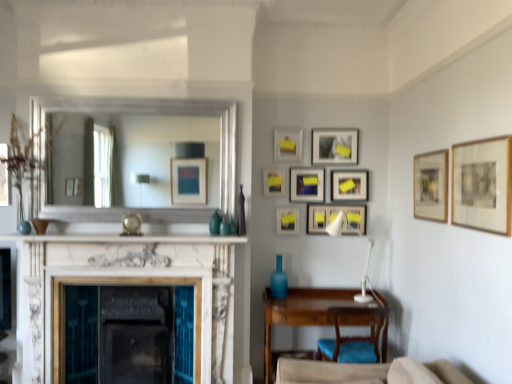
Looking at this image, what is the approximate height of white plastic lamp at center-right?

The height of white plastic lamp at center-right is 30.39 inches.

Locate an element on the screen. Image resolution: width=512 pixels, height=384 pixels. wooden desk at lower right is located at coordinates (300, 311).

In order to face wooden framed print at upper right, the ninth picture frame positioned from the back, should I rotate leftwards or rightwards?

Turn right approximately 27.218 degrees to face it.

Where is `matte black picture frame at center, which is the 2th picture frame from back to front`? matte black picture frame at center, which is the 2th picture frame from back to front is located at coordinates (334, 218).

What do you see at coordinates (306, 184) in the screenshot?
I see `matte black picture frame at center, positioned as the 9th picture frame in front-to-back order` at bounding box center [306, 184].

Where is `matte wooden picture frame at upper center, the seventh picture frame when ordered from back to front`? This screenshot has width=512, height=384. matte wooden picture frame at upper center, the seventh picture frame when ordered from back to front is located at coordinates (288, 145).

Where is `white plastic lamp at center-right`? white plastic lamp at center-right is located at coordinates (366, 278).

What's the angular difference between matte wooden picture frame at center, the 4th picture frame from the front, and silver/metallic mirror at upper center's facing directions?

matte wooden picture frame at center, the 4th picture frame from the front, and silver/metallic mirror at upper center are facing 0.138 degrees away from each other.

Considering the relative sizes of matte wooden picture frame at center, arranged as the 6th picture frame when viewed from the back, and silver/metallic mirror at upper center in the image provided, is matte wooden picture frame at center, arranged as the 6th picture frame when viewed from the back, thinner than silver/metallic mirror at upper center?

Yes, matte wooden picture frame at center, arranged as the 6th picture frame when viewed from the back, is thinner than silver/metallic mirror at upper center.

Which object is further away from the camera, matte wooden picture frame at center, arranged as the 6th picture frame when viewed from the back, or silver/metallic mirror at upper center?

matte wooden picture frame at center, arranged as the 6th picture frame when viewed from the back.

Which of these two, matte wooden picture frame at center, the 4th picture frame from the front, or silver/metallic mirror at upper center, is bigger?

silver/metallic mirror at upper center is bigger.

From a real-world perspective, is matte black picture frame at upper center, which appears as the 4th picture frame when viewed from the back, positioned over matte wooden picture frame at center, the 4th picture frame from the front, based on gravity?

Yes, from a real-world perspective, matte black picture frame at upper center, which appears as the 4th picture frame when viewed from the back, is on top of matte wooden picture frame at center, the 4th picture frame from the front.

Does matte black picture frame at upper center, which appears as the 4th picture frame when viewed from the back, turn towards matte wooden picture frame at center, arranged as the 6th picture frame when viewed from the back?

No, matte black picture frame at upper center, which appears as the 4th picture frame when viewed from the back, does not turn towards matte wooden picture frame at center, arranged as the 6th picture frame when viewed from the back.

Are matte black picture frame at upper center, the sixth picture frame when ordered from front to back, and matte wooden picture frame at center, arranged as the 6th picture frame when viewed from the back, making contact?

matte black picture frame at upper center, the sixth picture frame when ordered from front to back, is not next to matte wooden picture frame at center, arranged as the 6th picture frame when viewed from the back, and they're not touching.

How different are the orientations of matte black picture frame at upper center, the sixth picture frame when ordered from front to back, and matte wooden picture frame at center, the 4th picture frame from the front, in degrees?

matte black picture frame at upper center, the sixth picture frame when ordered from front to back, and matte wooden picture frame at center, the 4th picture frame from the front, are facing 1.19 degrees away from each other.

Which of these two, matte wooden picture frame at upper center, which ranks as the fifth picture frame in front-to-back order, or wooden framed picture at right, the eighth picture frame when ordered from back to front, is smaller?

Smaller between the two is matte wooden picture frame at upper center, which ranks as the fifth picture frame in front-to-back order.

What's the angular difference between matte wooden picture frame at upper center, which appears as the 5th picture frame when viewed from the back, and wooden framed picture at right, the eighth picture frame when ordered from back to front,'s facing directions?

There is a 92.4-degree angle between the facing directions of matte wooden picture frame at upper center, which appears as the 5th picture frame when viewed from the back, and wooden framed picture at right, the eighth picture frame when ordered from back to front.

Considering the relative sizes of matte wooden picture frame at upper center, which appears as the 5th picture frame when viewed from the back, and wooden framed picture at right, placed as the second picture frame when sorted from front to back, in the image provided, is matte wooden picture frame at upper center, which appears as the 5th picture frame when viewed from the back, shorter than wooden framed picture at right, placed as the second picture frame when sorted from front to back,?

Correct, matte wooden picture frame at upper center, which appears as the 5th picture frame when viewed from the back, is not as tall as wooden framed picture at right, placed as the second picture frame when sorted from front to back.

From the image's perspective, between matte wooden picture frame at upper center, which ranks as the fifth picture frame in front-to-back order, and wooden framed picture at right, placed as the second picture frame when sorted from front to back, who is located below?

wooden framed picture at right, placed as the second picture frame when sorted from front to back.

Between matte black picture frame at center, which is the first picture frame from back to front, and white marble fireplace at center, which one appears on the right side from the viewer's perspective?

matte black picture frame at center, which is the first picture frame from back to front, is more to the right.

Where is `mantle that appears in front of the matte black picture frame at center, which is the first picture frame from back to front`? mantle that appears in front of the matte black picture frame at center, which is the first picture frame from back to front is located at coordinates (129, 239).

Which of these two, matte black picture frame at center, positioned as the 9th picture frame in front-to-back order, or white marble fireplace at center, is wider?

white marble fireplace at center is wider.

Does white marble fireplace at center appear on the left side of blue fabric chair at lower right?

Yes, white marble fireplace at center is to the left of blue fabric chair at lower right.

Considering their positions, is white marble fireplace at center located in front of or behind blue fabric chair at lower right?

Clearly, white marble fireplace at center is in front of blue fabric chair at lower right.

Which object is wider, white marble fireplace at center or blue fabric chair at lower right?

With larger width is white marble fireplace at center.

Considering the relative sizes of matte black picture frame at center-right, which is the third picture frame in back-to-front order, and wooden desk at lower right in the image provided, is matte black picture frame at center-right, which is the third picture frame in back-to-front order, thinner than wooden desk at lower right?

Indeed, matte black picture frame at center-right, which is the third picture frame in back-to-front order, has a lesser width compared to wooden desk at lower right.

Does point (352, 187) lie behind point (341, 298)?

Yes, point (352, 187) is behind point (341, 298).

Is matte black picture frame at center-right, which is the third picture frame in back-to-front order, positioned in front of wooden desk at lower right?

No, it is not.

Which of these two, matte black picture frame at center, which is the 2th picture frame from back to front, or wooden framed print at upper right, which is counted as the first picture frame, starting from the front, stands shorter?

matte black picture frame at center, which is the 2th picture frame from back to front.

Could you tell me if matte black picture frame at center, which is the 2th picture frame from back to front, is turned towards wooden framed print at upper right, which is counted as the first picture frame, starting from the front?

Yes, matte black picture frame at center, which is the 2th picture frame from back to front, is aimed at wooden framed print at upper right, which is counted as the first picture frame, starting from the front.

Based on the photo, from the image's perspective, which is below, matte black picture frame at center, the eighth picture frame positioned from the front, or wooden framed print at upper right, which is counted as the first picture frame, starting from the front?

matte black picture frame at center, the eighth picture frame positioned from the front, appears lower in the image.

Is matte black picture frame at center, which is the 2th picture frame from back to front, spatially inside wooden framed print at upper right, which is counted as the first picture frame, starting from the front, or outside of it?

matte black picture frame at center, which is the 2th picture frame from back to front, lies outside wooden framed print at upper right, which is counted as the first picture frame, starting from the front.

Locate an element on the screen. The width and height of the screenshot is (512, 384). mirror in front of the matte wooden picture frame at center, arranged as the 6th picture frame when viewed from the back is located at coordinates (167, 114).

The image size is (512, 384). In order to click on picture frame that is the 7th one above the matte wooden picture frame at center, arranged as the 6th picture frame when viewed from the back (from a real-world perspective) in this screenshot , I will do `click(335, 146)`.

Which object lies further to the anchor point matte black picture frame at center, the eighth picture frame positioned from the front, matte wooden picture frame at upper center, the third picture frame from the front, or matte black picture frame at center-right, which is the third picture frame in back-to-front order?

Among the two, matte wooden picture frame at upper center, the third picture frame from the front, is located further to matte black picture frame at center, the eighth picture frame positioned from the front.

Based on their spatial positions, is matte black picture frame at center-right, which is the third picture frame in back-to-front order, or white marble fireplace at center further from silver/metallic mirror at upper center?

matte black picture frame at center-right, which is the third picture frame in back-to-front order, is positioned further to the anchor silver/metallic mirror at upper center.

Which object lies further to the anchor point matte black picture frame at center, positioned as the 9th picture frame in front-to-back order, white marble fireplace at center or white marble fireplace at center?

Among the two, white marble fireplace at center is located further to matte black picture frame at center, positioned as the 9th picture frame in front-to-back order.

Looking at the image, which one is located further to matte black picture frame at center, which is the 2th picture frame from back to front, matte black picture frame at center, positioned as the 9th picture frame in front-to-back order, or white marble fireplace at center?

white marble fireplace at center.

Based on their spatial positions, is white marble fireplace at center or matte black picture frame at center, positioned as the 9th picture frame in front-to-back order, further from blue fabric chair at lower right?

white marble fireplace at center is positioned further to the anchor blue fabric chair at lower right.

Estimate the real-world distances between objects in this image. Which object is closer to wooden framed print at upper right, the ninth picture frame positioned from the back, white marble fireplace at center or white marble fireplace at center?

Among the two, white marble fireplace at center is located nearer to wooden framed print at upper right, the ninth picture frame positioned from the back.

Estimate the real-world distances between objects in this image. Which object is further from wooden desk at lower right, silver/metallic mirror at upper center or white marble fireplace at center?

Based on the image, silver/metallic mirror at upper center appears to be further to wooden desk at lower right.

Which object lies nearer to the anchor point matte black picture frame at upper center, the sixth picture frame when ordered from front to back, wooden framed print at upper right, the ninth picture frame positioned from the back, or matte wooden picture frame at center, the 4th picture frame from the front?

matte wooden picture frame at center, the 4th picture frame from the front.

Where is `chair situated between white marble fireplace at center and wooden framed picture at right, the eighth picture frame when ordered from back to front, from left to right`? chair situated between white marble fireplace at center and wooden framed picture at right, the eighth picture frame when ordered from back to front, from left to right is located at coordinates (353, 337).

The height and width of the screenshot is (384, 512). I want to click on picture frame positioned between wooden framed print at upper right, which is counted as the first picture frame, starting from the front, and matte wooden picture frame at upper center, the third picture frame from the front, from near to far, so click(x=431, y=186).

Where is `mirror between white marble fireplace at center and blue fabric chair at lower right from left to right`? The height and width of the screenshot is (384, 512). mirror between white marble fireplace at center and blue fabric chair at lower right from left to right is located at coordinates (167, 114).

At what (x,y) coordinates should I click in order to perform the action: click on mantle situated between silver/metallic mirror at upper center and matte wooden picture frame at upper center, the seventh picture frame when ordered from back to front, from left to right. Please return your answer as a coordinate pair (x, y). Image resolution: width=512 pixels, height=384 pixels. Looking at the image, I should click on (129, 239).